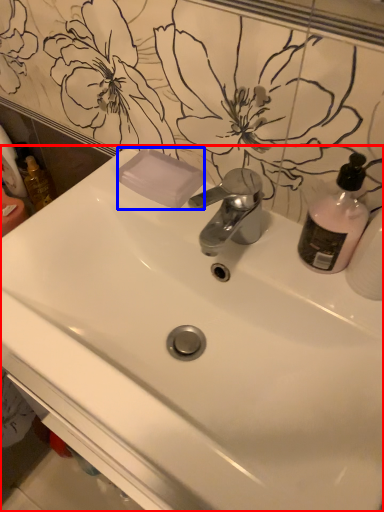
Question: Which of the following is the farthest to the observer, sink (highlighted by a red box) or soap (highlighted by a blue box)?

Choices:
 (A) sink
 (B) soap

Answer: (B)